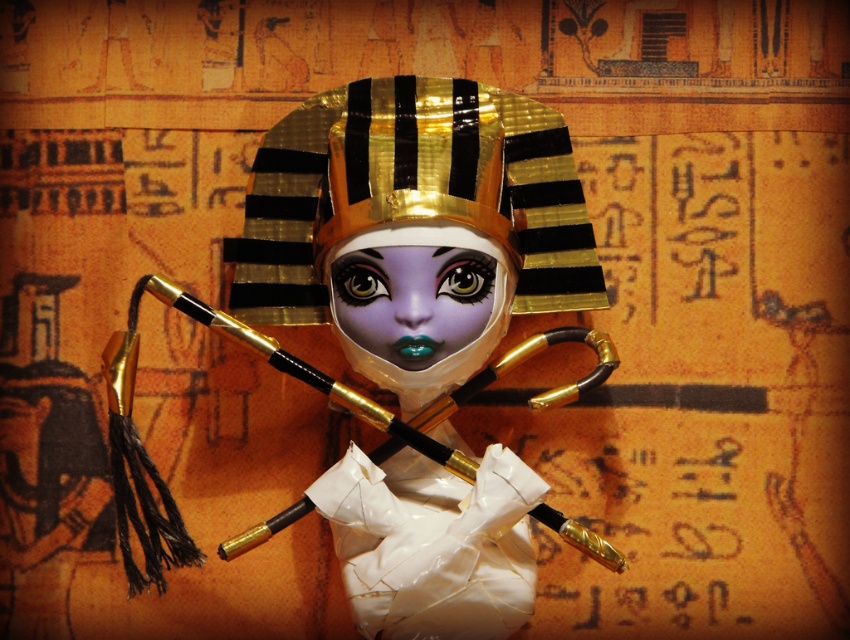
Who is positioned more to the right, gold/black striped headdress at center or shiny purple eye at center?

Positioned to the right is shiny purple eye at center.

Which is behind, point (156, 292) or point (455, 276)?

The point (156, 292) is more distant.

Where is `gold/black striped headdress at center`? This screenshot has height=640, width=850. gold/black striped headdress at center is located at coordinates (408, 228).

Does gold/black striped headdress at center have a smaller size compared to matte purple eye at center?

No, gold/black striped headdress at center is not smaller than matte purple eye at center.

Which is below, gold/black striped headdress at center or matte purple eye at center?

gold/black striped headdress at center

Where is `gold/black striped headdress at center`? gold/black striped headdress at center is located at coordinates (408, 228).

Can you confirm if shiny purple eye at center is positioned above matte purple eye at center?

Yes, shiny purple eye at center is above matte purple eye at center.

Is point (456, 250) farther from viewer compared to point (384, 289)?

No, (456, 250) is in front of (384, 289).

This screenshot has width=850, height=640. In order to click on shiny purple eye at center in this screenshot , I will do `click(463, 275)`.